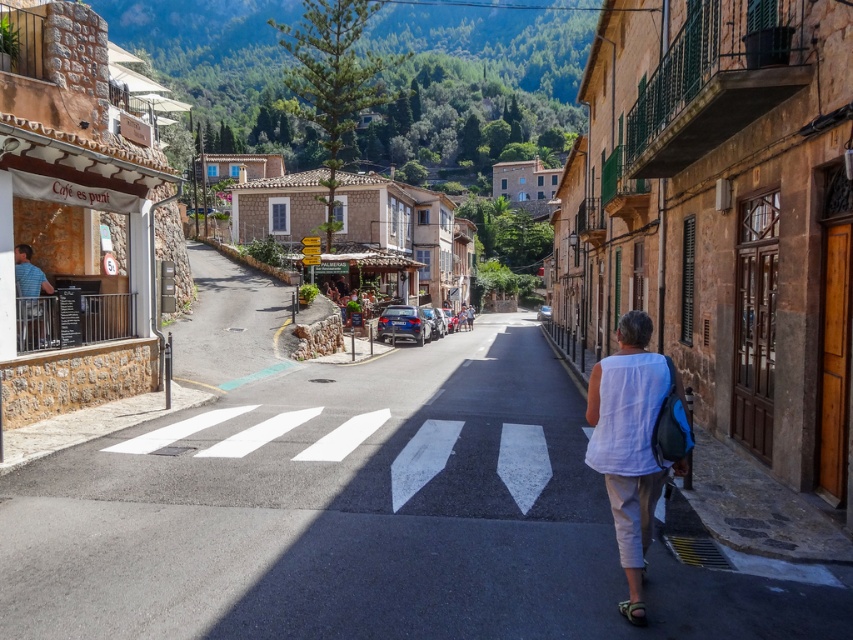
Question: Which of the following is the farthest from the observer?

Choices:
 (A) white cotton shirt at lower right
 (B) asphalt road at center

Answer: (A)

Question: Can you confirm if asphalt road at center is positioned above white cotton shirt at lower right?

Choices:
 (A) no
 (B) yes

Answer: (A)

Question: Can you confirm if asphalt road at center is smaller than white cotton shirt at lower right?

Choices:
 (A) no
 (B) yes

Answer: (A)

Question: Which object is farther from the camera taking this photo?

Choices:
 (A) asphalt road at center
 (B) white cotton shirt at lower right

Answer: (B)

Question: From the image, what is the correct spatial relationship of asphalt road at center in relation to white cotton shirt at lower right?

Choices:
 (A) right
 (B) left

Answer: (B)